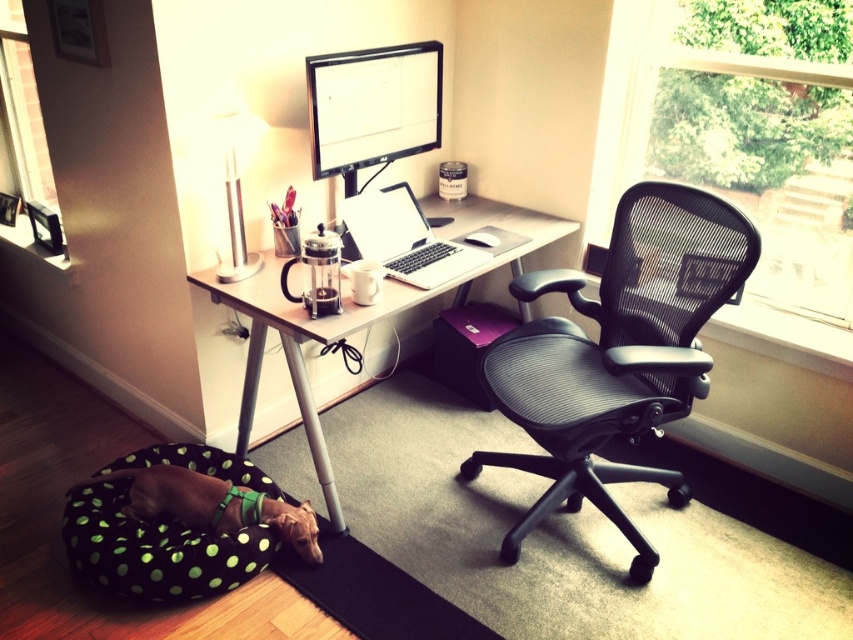
Question: Can you confirm if matte black monitor at upper center is thinner than green dotted fabric dog bed at lower left?

Choices:
 (A) yes
 (B) no

Answer: (A)

Question: Which point is farther to the camera?

Choices:
 (A) satin silver laptop at center
 (B) white plastic table at center
 (C) transparent mesh chair at right

Answer: (C)

Question: Estimate the real-world distances between objects in this image. Which object is farther from the white plastic table at center?

Choices:
 (A) matte black monitor at upper center
 (B) satin silver laptop at center
 (C) green dotted fabric dog bed at lower left
 (D) black mesh swivel chair at center

Answer: (D)

Question: Which object appears closest to the camera in this image?

Choices:
 (A) matte black monitor at upper center
 (B) satin silver laptop at center
 (C) white plastic table at center
 (D) black mesh swivel chair at center

Answer: (D)

Question: Can you confirm if matte black monitor at upper center is positioned to the left of green dotted fabric dog bed at lower left?

Choices:
 (A) yes
 (B) no

Answer: (B)

Question: Is white plastic table at center smaller than satin silver laptop at center?

Choices:
 (A) no
 (B) yes

Answer: (A)